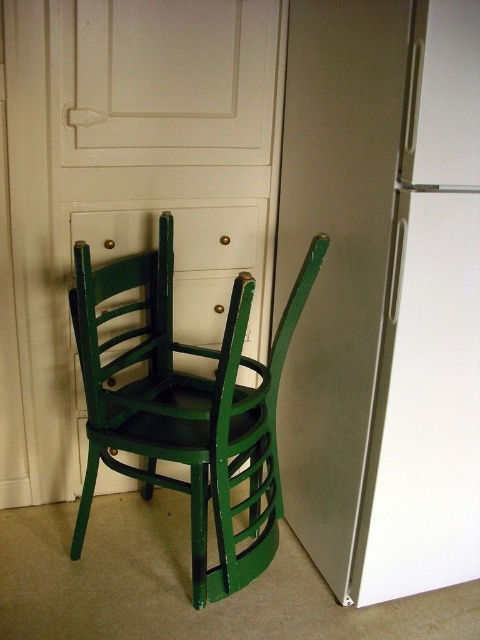
Question: Can you confirm if satin white refrigerator at center right is positioned to the left of green matte wood chair at center?

Choices:
 (A) yes
 (B) no

Answer: (B)

Question: Which of the following is the closest to the observer?

Choices:
 (A) (431, 227)
 (B) (269, 444)

Answer: (A)

Question: Which object is farther from the camera taking this photo?

Choices:
 (A) green matte wood chair at center
 (B) satin white refrigerator at center right

Answer: (A)

Question: Is satin white refrigerator at center right closer to camera compared to green matte wood chair at center?

Choices:
 (A) yes
 (B) no

Answer: (A)

Question: Can you confirm if satin white refrigerator at center right is positioned below green matte wood chair at center?

Choices:
 (A) no
 (B) yes

Answer: (A)